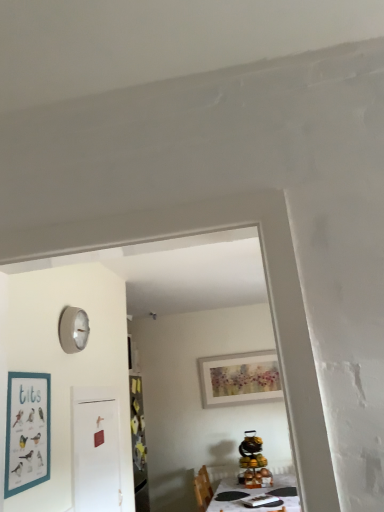
Question: Is white glossy table at lower center bigger or smaller than watercolor paper picture frame at upper center, marked as the 2th picture frame in a left-to-right arrangement?

Choices:
 (A) small
 (B) big

Answer: (B)

Question: From a real-world perspective, is white glossy table at lower center physically located above or below watercolor paper picture frame at upper center, arranged as the 1th picture frame when viewed from the right?

Choices:
 (A) above
 (B) below

Answer: (B)

Question: Which object is the closest to the teal matte picture frame at left, the first picture frame from the front?

Choices:
 (A) white matte door at center
 (B) white glossy table at lower center
 (C) watercolor paper picture frame at upper center, the 1th picture frame positioned from the bottom

Answer: (A)

Question: Considering the real-world distances, which object is farthest from the teal matte picture frame at left, marked as the second picture frame in a right-to-left arrangement?

Choices:
 (A) watercolor paper picture frame at upper center, marked as the 2th picture frame in a left-to-right arrangement
 (B) white glossy table at lower center
 (C) white matte door at center

Answer: (A)